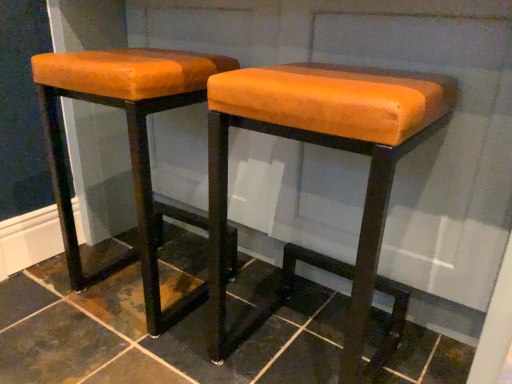
The height and width of the screenshot is (384, 512). I want to click on dark brown tile at center, so click(x=154, y=339).

Locate an element on the screen. Image resolution: width=512 pixels, height=384 pixels. dark brown tile at center is located at coordinates [x=154, y=339].

From the image's perspective, which one is positioned higher, orange leather stool at center, positioned as the 2th stool in left-to-right order, or orange leather stool at left, placed as the second stool when sorted from right to left?

orange leather stool at left, placed as the second stool when sorted from right to left, appears higher in the image.

From a real-world perspective, is orange leather stool at center, positioned as the 2th stool in left-to-right order, above or below orange leather stool at left, which is counted as the first stool, starting from the left?

Clearly, from a real-world perspective, orange leather stool at center, positioned as the 2th stool in left-to-right order, is above orange leather stool at left, which is counted as the first stool, starting from the left.

Does orange leather stool at center, positioned as the 2th stool in left-to-right order, have a greater width compared to orange leather stool at left, which is counted as the first stool, starting from the left?

Indeed, orange leather stool at center, positioned as the 2th stool in left-to-right order, has a greater width compared to orange leather stool at left, which is counted as the first stool, starting from the left.

Which is in front, orange leather stool at center, the first stool in the right-to-left sequence, or orange leather stool at left, which is counted as the first stool, starting from the left?

Positioned in front is orange leather stool at center, the first stool in the right-to-left sequence.

Considering the sizes of dark brown tile at center and orange leather stool at center, positioned as the 2th stool in left-to-right order, in the image, is dark brown tile at center bigger or smaller than orange leather stool at center, positioned as the 2th stool in left-to-right order,?

Clearly, dark brown tile at center is smaller in size than orange leather stool at center, positioned as the 2th stool in left-to-right order.

Between point (202, 368) and point (210, 308), which one is positioned behind?

The point (202, 368) is more distant.

Can you confirm if dark brown tile at center is wider than orange leather stool at center, positioned as the 2th stool in left-to-right order?

Indeed, dark brown tile at center has a greater width compared to orange leather stool at center, positioned as the 2th stool in left-to-right order.

Would you say orange leather stool at left, which is counted as the first stool, starting from the left, contains dark brown tile at center?

No, dark brown tile at center is not a part of orange leather stool at left, which is counted as the first stool, starting from the left.

Can you confirm if orange leather stool at left, placed as the second stool when sorted from right to left, is bigger than dark brown tile at center?

Yes, orange leather stool at left, placed as the second stool when sorted from right to left, is bigger than dark brown tile at center.

From the image's perspective, is orange leather stool at left, which is counted as the first stool, starting from the left, located above or below dark brown tile at center?

Clearly, from the image's perspective, orange leather stool at left, which is counted as the first stool, starting from the left, is above dark brown tile at center.

I want to click on tile on the right of orange leather stool at left, placed as the second stool when sorted from right to left, so click(x=154, y=339).

From a real-world perspective, is dark brown tile at center positioned over orange leather stool at left, which is counted as the first stool, starting from the left, based on gravity?

Actually, dark brown tile at center is physically below orange leather stool at left, which is counted as the first stool, starting from the left, in the real world.

Is dark brown tile at center in front of or behind orange leather stool at left, which is counted as the first stool, starting from the left, in the image?

Visually, dark brown tile at center is located in front of orange leather stool at left, which is counted as the first stool, starting from the left.

From the image's perspective, is dark brown tile at center over orange leather stool at left, which is counted as the first stool, starting from the left?

No, from the image's perspective, dark brown tile at center is not above orange leather stool at left, which is counted as the first stool, starting from the left.

Which of these two, dark brown tile at center or orange leather stool at left, which is counted as the first stool, starting from the left, is smaller?

With smaller size is dark brown tile at center.

Between orange leather stool at center, positioned as the 2th stool in left-to-right order, and dark brown tile at center, which one has more height?

orange leather stool at center, positioned as the 2th stool in left-to-right order.

Can you confirm if orange leather stool at center, the first stool in the right-to-left sequence, is thinner than dark brown tile at center?

Indeed, orange leather stool at center, the first stool in the right-to-left sequence, has a lesser width compared to dark brown tile at center.

There is a dark brown tile at center. Where is `the 1st stool above it (from the image's perspective)`? the 1st stool above it (from the image's perspective) is located at coordinates (327, 147).

Which object is positioned more to the right, orange leather stool at center, the first stool in the right-to-left sequence, or dark brown tile at center?

orange leather stool at center, the first stool in the right-to-left sequence.

From a real-world perspective, is orange leather stool at left, placed as the second stool when sorted from right to left, above or below orange leather stool at center, positioned as the 2th stool in left-to-right order?

Clearly, from a real-world perspective, orange leather stool at left, placed as the second stool when sorted from right to left, is below orange leather stool at center, positioned as the 2th stool in left-to-right order.

Is point (96, 275) behind point (376, 255)?

Yes, point (96, 275) is behind point (376, 255).

Does orange leather stool at left, which is counted as the first stool, starting from the left, have a lesser height compared to orange leather stool at center, the first stool in the right-to-left sequence?

In fact, orange leather stool at left, which is counted as the first stool, starting from the left, may be taller than orange leather stool at center, the first stool in the right-to-left sequence.

Visually, is orange leather stool at left, which is counted as the first stool, starting from the left, positioned to the left or to the right of orange leather stool at center, the first stool in the right-to-left sequence?

Clearly, orange leather stool at left, which is counted as the first stool, starting from the left, is on the left of orange leather stool at center, the first stool in the right-to-left sequence, in the image.

Locate an element on the screen. stool below the orange leather stool at center, positioned as the 2th stool in left-to-right order (from a real-world perspective) is located at coordinates (129, 145).

Find the location of `stool located on the right of dark brown tile at center`. stool located on the right of dark brown tile at center is located at coordinates (327, 147).

Looking at the image, which one is located further to dark brown tile at center, orange leather stool at left, which is counted as the first stool, starting from the left, or orange leather stool at center, positioned as the 2th stool in left-to-right order?

orange leather stool at center, positioned as the 2th stool in left-to-right order, is further to dark brown tile at center.

Which object lies further to the anchor point orange leather stool at center, the first stool in the right-to-left sequence, dark brown tile at center or orange leather stool at left, placed as the second stool when sorted from right to left?

dark brown tile at center.

Estimate the real-world distances between objects in this image. Which object is further from orange leather stool at left, which is counted as the first stool, starting from the left, dark brown tile at center or orange leather stool at center, positioned as the 2th stool in left-to-right order?

Among the two, orange leather stool at center, positioned as the 2th stool in left-to-right order, is located further to orange leather stool at left, which is counted as the first stool, starting from the left.

From the image, which object appears to be nearer to dark brown tile at center, orange leather stool at center, positioned as the 2th stool in left-to-right order, or orange leather stool at left, placed as the second stool when sorted from right to left?

orange leather stool at left, placed as the second stool when sorted from right to left, is closer to dark brown tile at center.

Based on their spatial positions, is orange leather stool at left, which is counted as the first stool, starting from the left, or dark brown tile at center further from orange leather stool at center, positioned as the 2th stool in left-to-right order?

Among the two, dark brown tile at center is located further to orange leather stool at center, positioned as the 2th stool in left-to-right order.

Estimate the real-world distances between objects in this image. Which object is closer to orange leather stool at left, which is counted as the first stool, starting from the left, orange leather stool at center, the first stool in the right-to-left sequence, or dark brown tile at center?

Among the two, dark brown tile at center is located nearer to orange leather stool at left, which is counted as the first stool, starting from the left.

Locate an element on the screen. The width and height of the screenshot is (512, 384). tile between orange leather stool at left, placed as the second stool when sorted from right to left, and orange leather stool at center, the first stool in the right-to-left sequence is located at coordinates (154, 339).